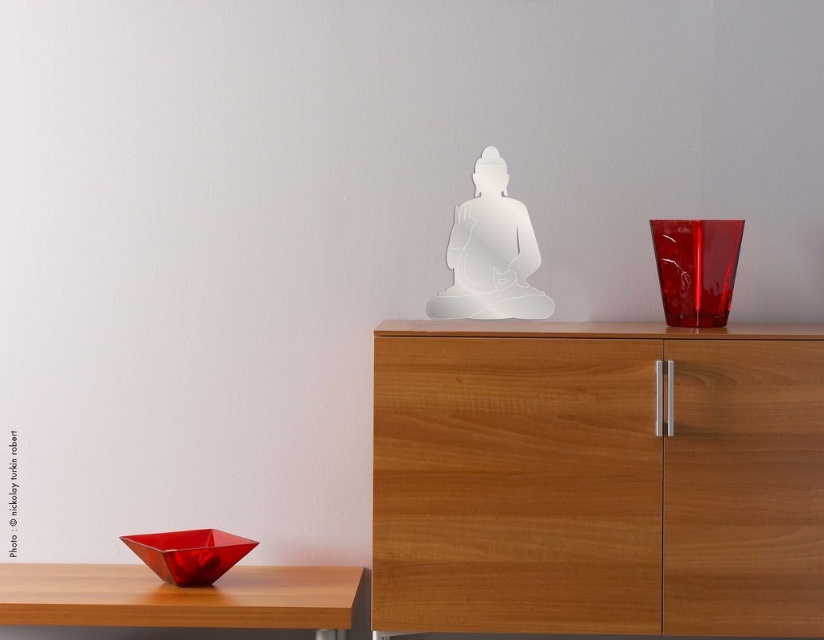
Question: Estimate the real-world distances between objects in this image. Which object is farther from the transparent glass buddha at center?

Choices:
 (A) wooden table at lower left
 (B) transparent glass vase at upper right
 (C) wooden cabinet at upper center

Answer: (A)

Question: Can you confirm if transparent glass buddha at center is wider than transparent glass vase at upper right?

Choices:
 (A) no
 (B) yes

Answer: (B)

Question: Which of the following is the farthest from the observer?

Choices:
 (A) (16, 576)
 (B) (467, 211)
 (C) (736, 396)
 (D) (705, 276)

Answer: (B)

Question: Which point is farther to the camera?

Choices:
 (A) (719, 276)
 (B) (474, 284)

Answer: (B)

Question: Is wooden cabinet at upper center to the left of wooden table at lower left from the viewer's perspective?

Choices:
 (A) yes
 (B) no

Answer: (B)

Question: Does wooden cabinet at upper center appear over transparent glass buddha at center?

Choices:
 (A) no
 (B) yes

Answer: (A)